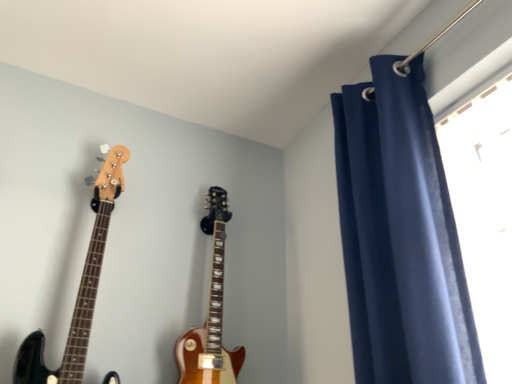
Question: From the image's perspective, relative to glossy wood guitar at left, acting as the 1th guitar starting from the left, is glossy wood guitar at center, which is the 1th guitar from right to left, above or below?

Choices:
 (A) above
 (B) below

Answer: (B)

Question: From their relative heights in the image, would you say glossy wood guitar at center, which is the 1th guitar from right to left, is taller or shorter than glossy wood guitar at left, the second guitar positioned from the right?

Choices:
 (A) short
 (B) tall

Answer: (A)

Question: Estimate the real-world distances between objects in this image. Which object is farther from the glossy wood guitar at left, the second guitar positioned from the right?

Choices:
 (A) glossy wood guitar at center, which is the 1th guitar from right to left
 (B) navy blue velvet curtain at upper right

Answer: (B)

Question: Which object is positioned farthest from the glossy wood guitar at left, acting as the 1th guitar starting from the left?

Choices:
 (A) navy blue velvet curtain at upper right
 (B) glossy wood guitar at center, which is the 1th guitar from right to left

Answer: (A)